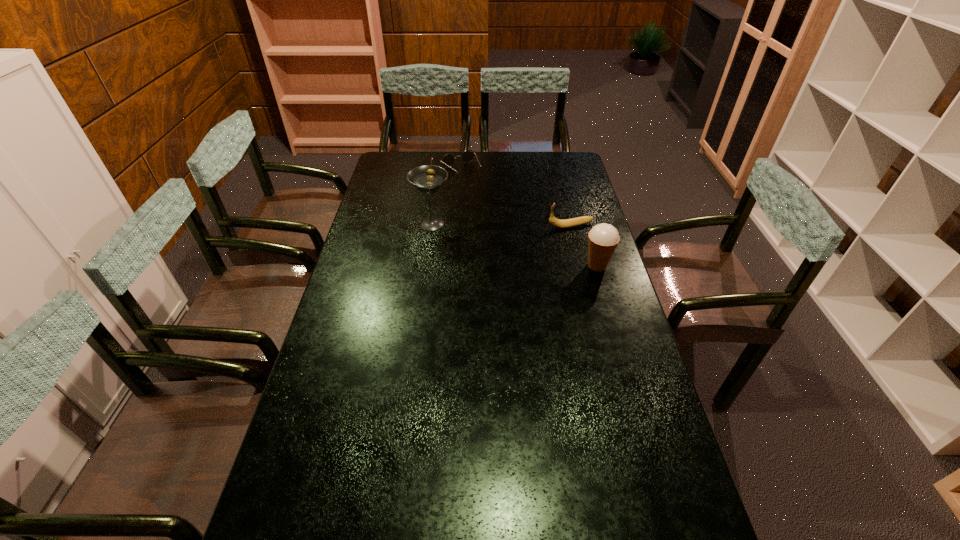
In order to click on free space that is in between the tallest object and the nearest object in this screenshot , I will do `click(515, 245)`.

Where is `object identified as the third closest to the shortest object`? The image size is (960, 540). object identified as the third closest to the shortest object is located at coordinates [x=603, y=238].

Identify the location of object that is the closest one to the banana. The width and height of the screenshot is (960, 540). (603, 238).

Locate an element on the screen. free space that satisfies the following two spatial constraints: 1. on the front side of the third shortest object; 2. on the right side of the tallest object is located at coordinates (426, 266).

This screenshot has height=540, width=960. I want to click on vacant area that satisfies the following two spatial constraints: 1. on the front side of the banana; 2. on the right side of the icecream, so click(x=581, y=266).

Where is `free space that satisfies the following two spatial constraints: 1. on the front side of the second shortest object; 2. on the right side of the farthest object`? free space that satisfies the following two spatial constraints: 1. on the front side of the second shortest object; 2. on the right side of the farthest object is located at coordinates (457, 226).

Where is `free space that satisfies the following two spatial constraints: 1. on the front side of the spectacles; 2. on the left side of the banana`? This screenshot has width=960, height=540. free space that satisfies the following two spatial constraints: 1. on the front side of the spectacles; 2. on the left side of the banana is located at coordinates (457, 226).